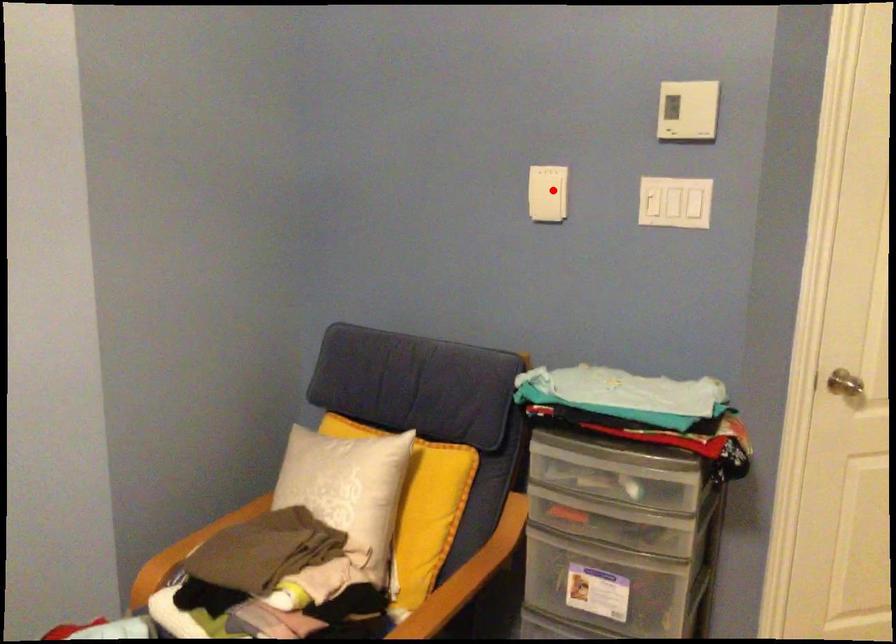
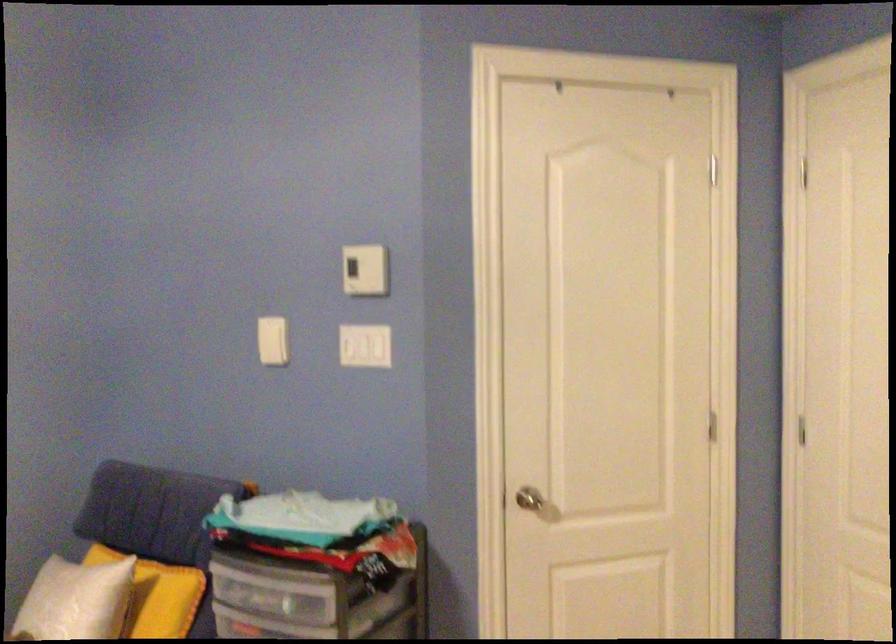
Find the pixel in the second image that matches the highlighted location in the first image.

(272, 341)